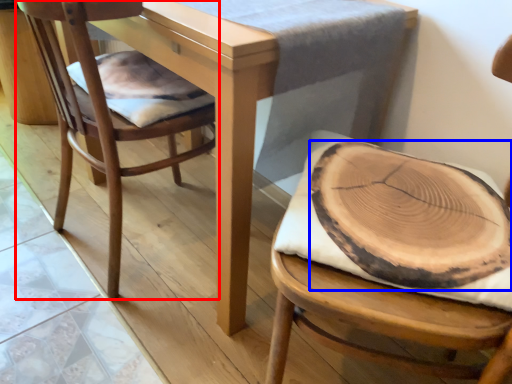
Question: Which object appears farthest to the camera in this image, chair (highlighted by a red box) or food (highlighted by a blue box)?

Choices:
 (A) chair
 (B) food

Answer: (A)